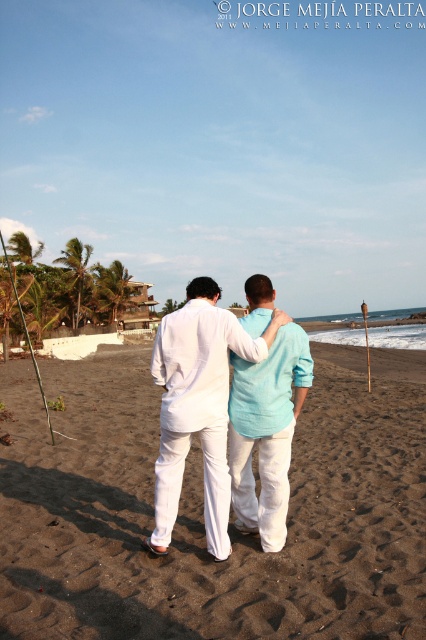
You are a photographer standing on the beach and want to take a photo of both the white linen shirt at center and the light blue linen shirt at center. However, you notice that one of them is blocking the view of the other. Which shirt is blocking the view of the other?

The white linen shirt at center is positioned under the light blue linen shirt at center, so the white linen shirt at center is blocking the view of the light blue linen shirt at center.

You are a photographer standing on the sandy beach at center. You want to take a photo of the two people walking away from you. How far apart are they from each other?

The two people are 3.08 meters apart from each other.

You are a photographer trying to capture a clear shot of both the white linen shirt at center and the light blue linen shirt at center. Since you want both subjects to appear equally sized in the photo, which direction should you move your camera? Explain your reasoning based on their sizes.

The white linen shirt at center is larger in size than the light blue linen shirt at center. To make them appear equal in size in the photo, you should move the camera closer to the light blue linen shirt at center and farther from the white linen shirt at center. This adjustment will reduce the size of the larger white linen shirt while enlarging the smaller light blue one, balancing their apparent sizes.